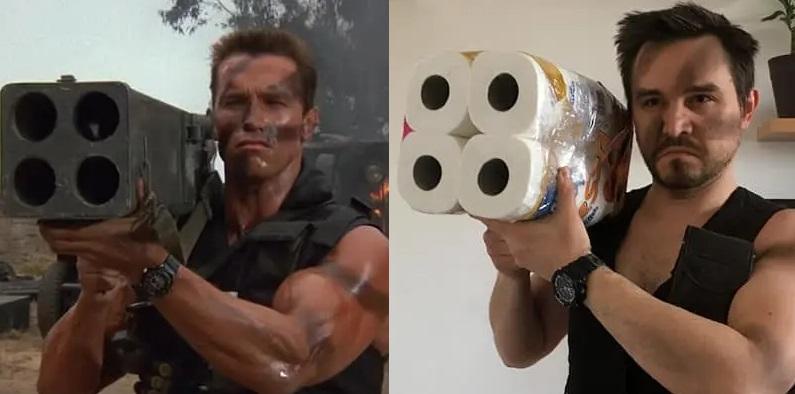
You are a GUI agent. You are given a task and a screenshot of the screen. Output one action in this format:
    pyautogui.click(x=<x>, y=<y>)
    Task: Click on the black pot for plants
    This screenshot has height=394, width=795.
    Given the screenshot: What is the action you would take?
    pyautogui.click(x=776, y=71)